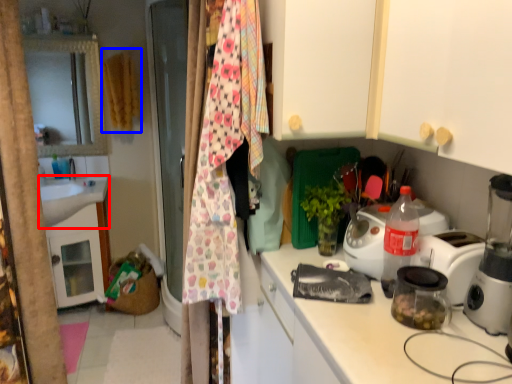
Question: Among these objects, which one is farthest to the camera, sink (highlighted by a red box) or clothesline (highlighted by a blue box)?

Choices:
 (A) sink
 (B) clothesline

Answer: (B)